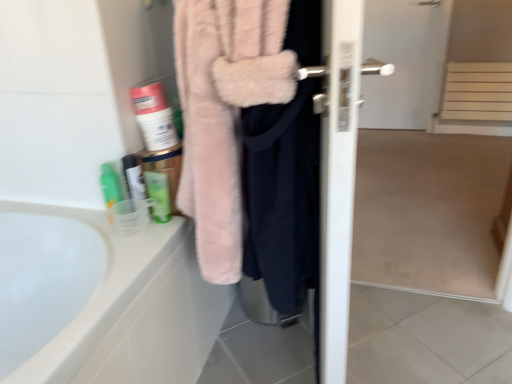
Question: Does white matte screen door at center have a larger size compared to translucent plastic cup at lower left, arranged as the third toiletry when viewed from the right?

Choices:
 (A) no
 (B) yes

Answer: (B)

Question: Is translucent plastic cup at lower left, arranged as the 1th toiletry when viewed from the left, located within white matte screen door at center?

Choices:
 (A) no
 (B) yes

Answer: (A)

Question: Is white matte screen door at center further to the viewer compared to translucent plastic cup at lower left, arranged as the third toiletry when viewed from the right?

Choices:
 (A) yes
 (B) no

Answer: (B)

Question: Is white matte screen door at center directly adjacent to translucent plastic cup at lower left, arranged as the 1th toiletry when viewed from the left?

Choices:
 (A) yes
 (B) no

Answer: (B)

Question: Is white matte screen door at center not near translucent plastic cup at lower left, arranged as the third toiletry when viewed from the right?

Choices:
 (A) yes
 (B) no

Answer: (A)

Question: Considering the positions of translucent plastic cup at lower left, the second toiletry positioned from the left, and white matte screen door at center in the image, is translucent plastic cup at lower left, the second toiletry positioned from the left, taller or shorter than white matte screen door at center?

Choices:
 (A) tall
 (B) short

Answer: (B)

Question: In the image, is translucent plastic cup at lower left, placed as the second toiletry when sorted from right to left, positioned in front of or behind white matte screen door at center?

Choices:
 (A) front
 (B) behind

Answer: (A)

Question: From the image's perspective, is translucent plastic cup at lower left, placed as the second toiletry when sorted from right to left, located above or below white matte screen door at center?

Choices:
 (A) below
 (B) above

Answer: (A)

Question: Is point (138, 208) closer or farther from the camera than point (445, 256)?

Choices:
 (A) closer
 (B) farther

Answer: (A)

Question: Relative to white matte screen door at center, is fluffy pink towel at upper right in front or behind?

Choices:
 (A) front
 (B) behind

Answer: (A)

Question: From a real-world perspective, is fluffy pink towel at upper right physically located above or below white matte screen door at center?

Choices:
 (A) above
 (B) below

Answer: (A)

Question: Is point (221, 168) closer or farther from the camera than point (428, 62)?

Choices:
 (A) farther
 (B) closer

Answer: (B)

Question: Is fluffy pink towel at upper right taller or shorter than white matte screen door at center?

Choices:
 (A) short
 (B) tall

Answer: (A)

Question: Do you think green matte tube at upper left, the 1th toiletry viewed from the right, is within translucent plastic cup at lower left, the second toiletry positioned from the left, or outside of it?

Choices:
 (A) inside
 (B) outside

Answer: (B)

Question: From the image's perspective, is green matte tube at upper left, positioned as the 3th toiletry in left-to-right order, above or below translucent plastic cup at lower left, the second toiletry positioned from the left?

Choices:
 (A) below
 (B) above

Answer: (A)